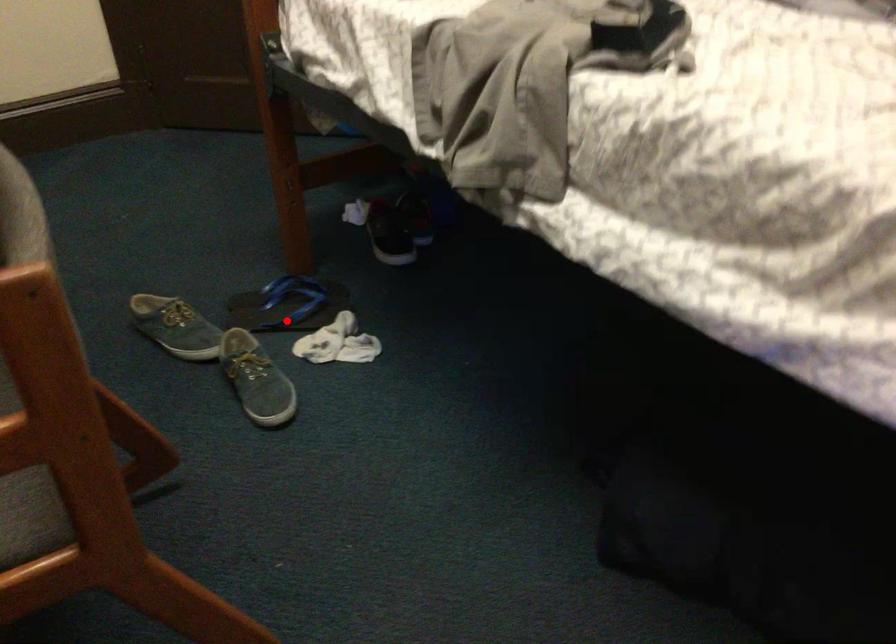
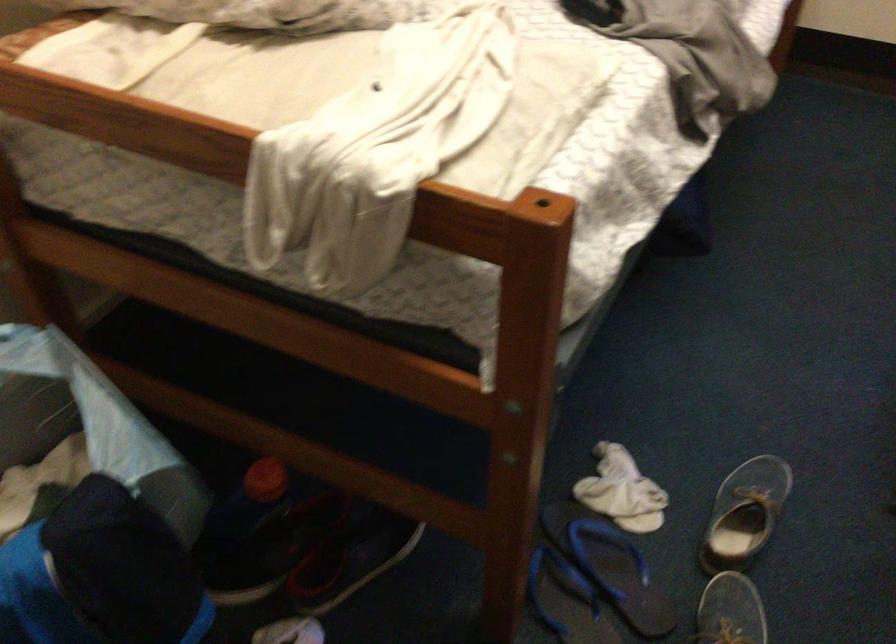
Locate, in the second image, the point that corresponds to the highlighted location in the first image.

(609, 565)